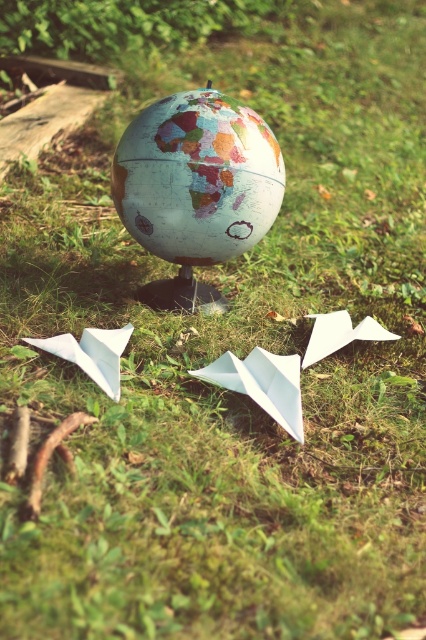
Question: Which point is farther to the camera?

Choices:
 (A) (287, 404)
 (B) (327, 332)

Answer: (B)

Question: Estimate the real-world distances between objects in this image. Which object is farther from the white paper airplane at center?

Choices:
 (A) matte globe at center
 (B) white paper at lower left
 (C) white paper airplane at lower right

Answer: (A)

Question: Is matte globe at center further to camera compared to white paper airplane at lower right?

Choices:
 (A) no
 (B) yes

Answer: (B)

Question: Estimate the real-world distances between objects in this image. Which object is farther from the white paper airplane at lower right?

Choices:
 (A) white paper at lower left
 (B) matte globe at center
 (C) white paper airplane at center

Answer: (A)

Question: Is matte globe at center wider than white paper at lower left?

Choices:
 (A) no
 (B) yes

Answer: (B)

Question: Does matte globe at center appear over white paper airplane at lower right?

Choices:
 (A) yes
 (B) no

Answer: (A)